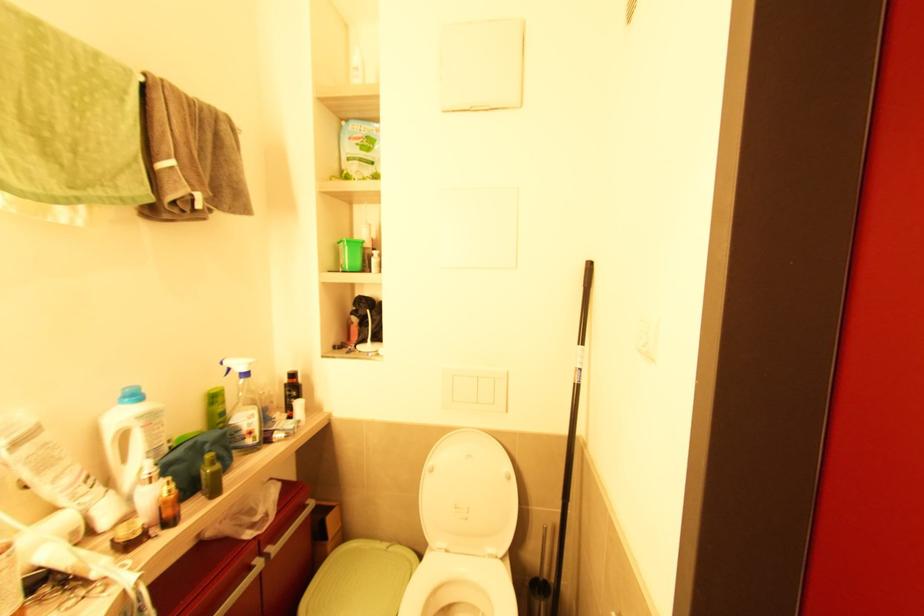
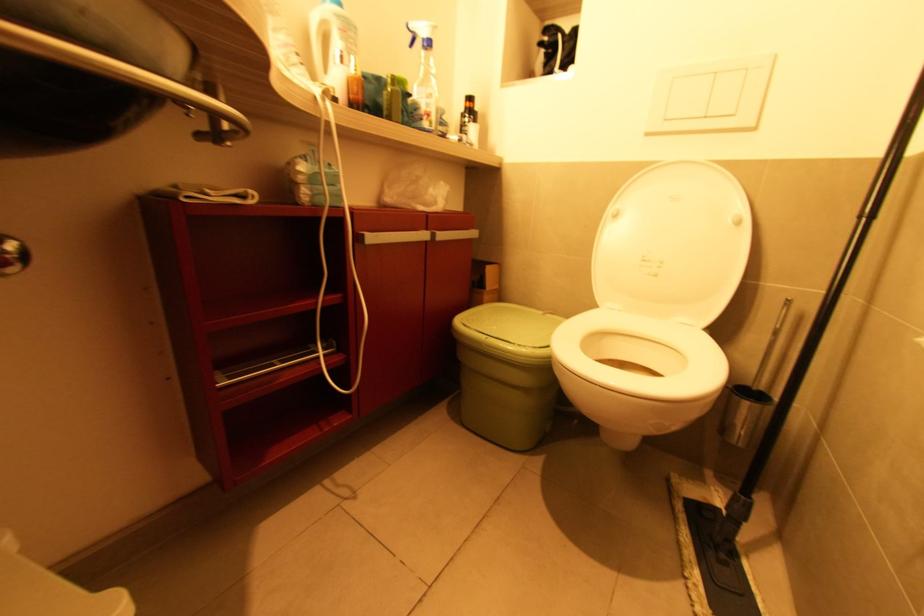
The point at (259, 565) is marked in the first image. Where is the corresponding point in the second image?

(426, 237)